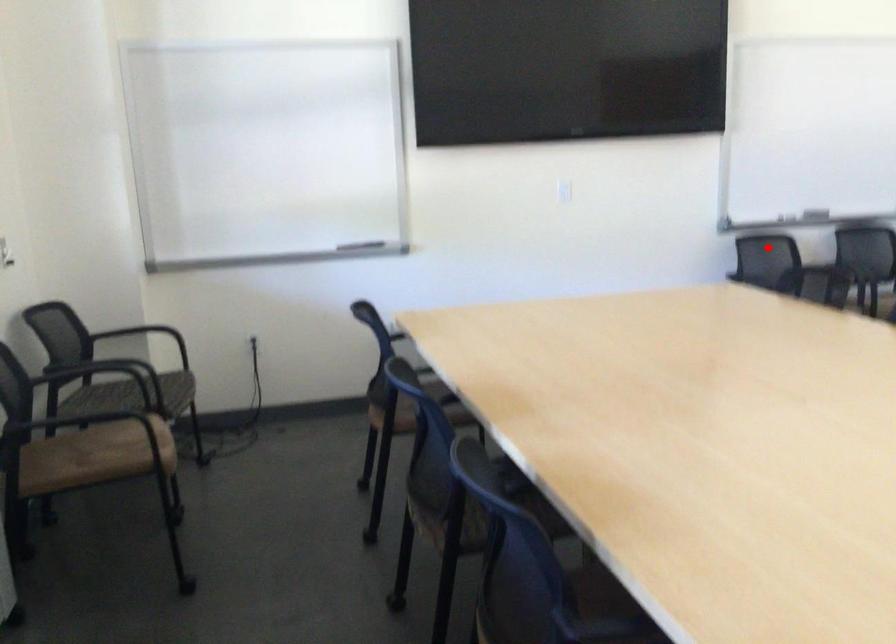
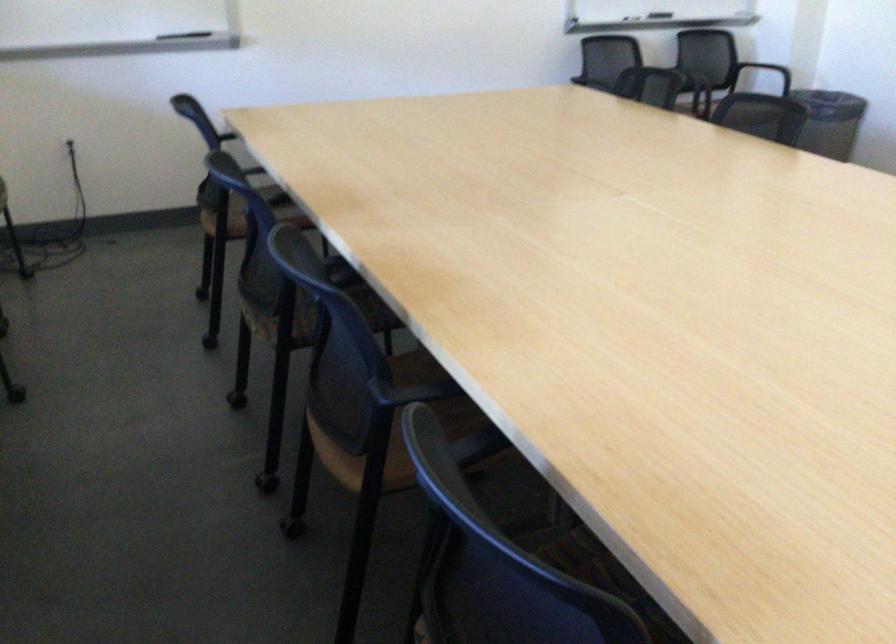
Where in the second image is the point corresponding to the highlighted location from the first image?

(607, 57)